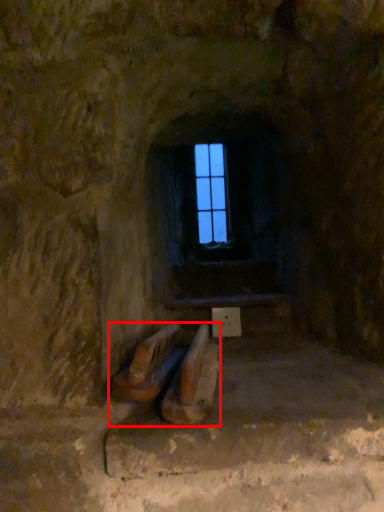
Question: From the image's perspective, where is furniture (annotated by the red box) located in relation to window frame in the image?

Choices:
 (A) above
 (B) below

Answer: (B)